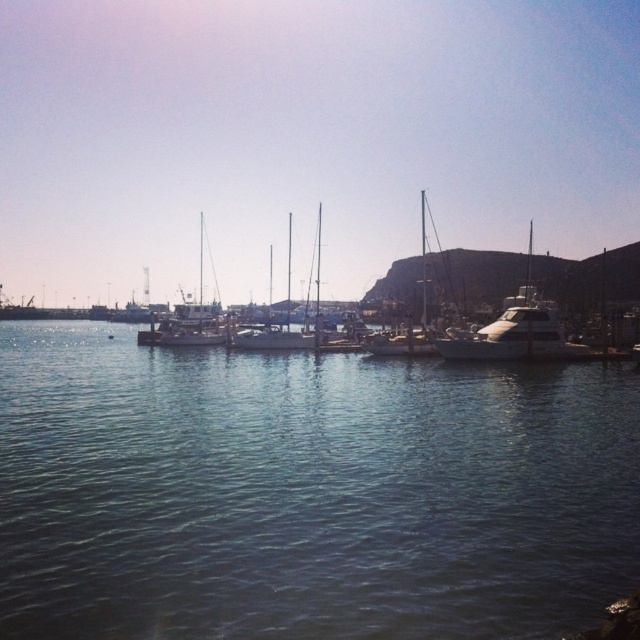
You are a sailor trying to navigate a small boat through the marina. You notice the clear water at center and the white glossy yacht at center. Which one is wider?

The white glossy yacht at center is wider than the clear water at center.

You are standing on the dock and want to throw a small floating toy into the water. The toy needs to float between the clear water at center and the green algae patch at lower right. How far apart are these two areas?

The clear water at center and the green algae patch at lower right are 8.65 meters apart.